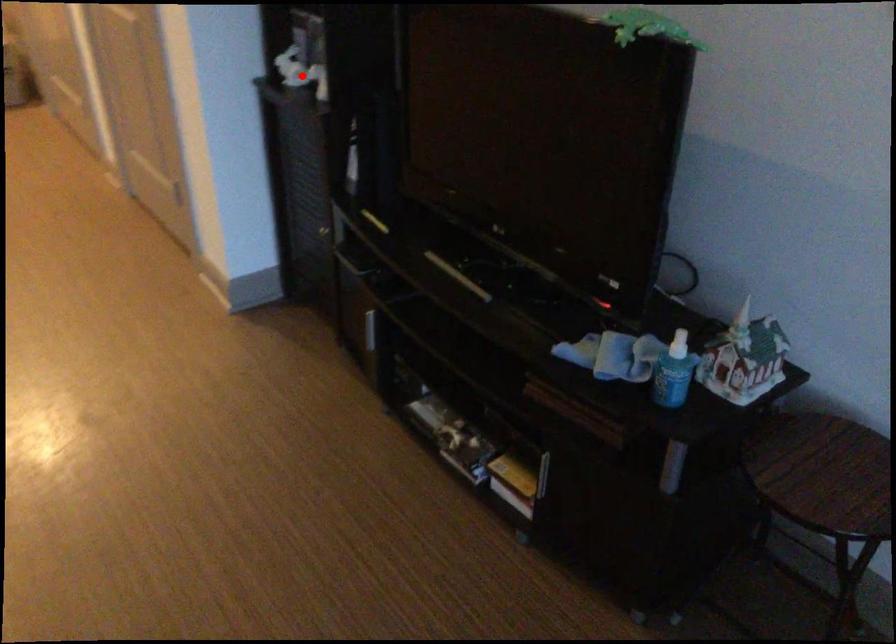
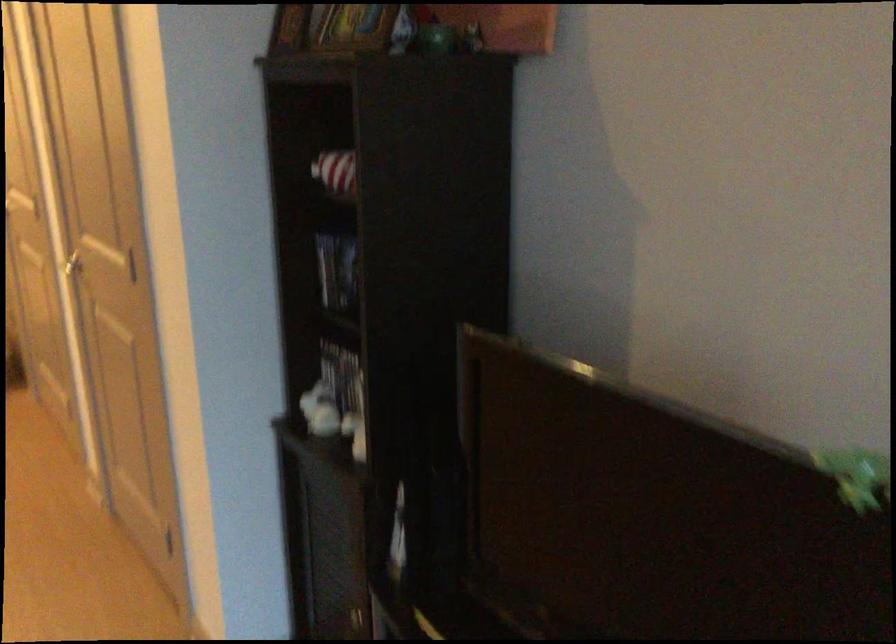
Question: I am providing you with two images of the same scene from different viewpoints. In image1, a red point is highlighted. Considering the same 3D point in image2, which of the following is correct?

Choices:
 (A) It is closer
 (B) It is farther

Answer: (A)